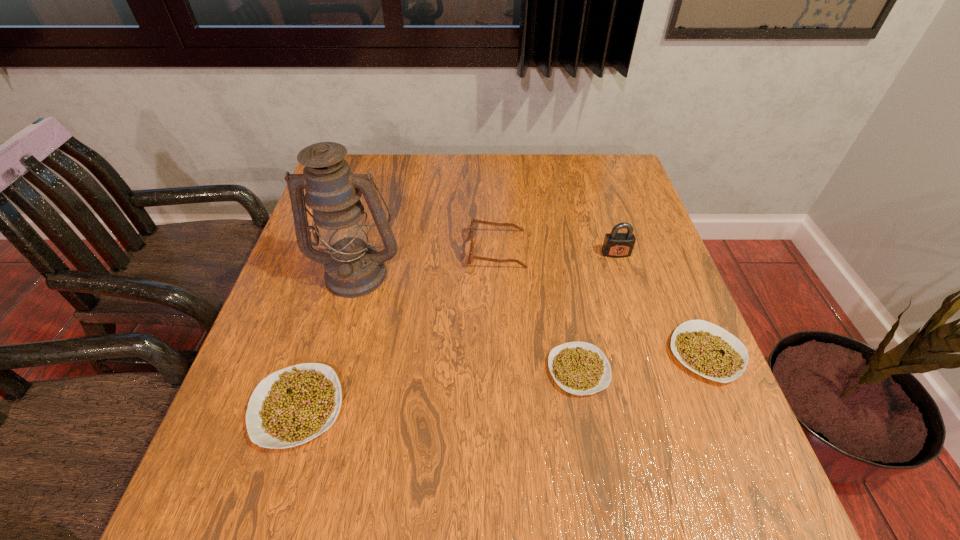
Where is `object that can be found as the fourth closest to the shortest legume`? The width and height of the screenshot is (960, 540). object that can be found as the fourth closest to the shortest legume is located at coordinates (353, 268).

Locate which legume ranks second in proximity to the third object from left to right. Please provide its 2D coordinates. Your answer should be formatted as a tuple, i.e. [(x, y)], where the tuple contains the x and y coordinates of a point satisfying the conditions above.

[(710, 351)]

Where is `legume that stands as the closest to the oil lamp`? Image resolution: width=960 pixels, height=540 pixels. legume that stands as the closest to the oil lamp is located at coordinates (292, 406).

Identify the location of free space that satisfies the following two spatial constraints: 1. on the front-facing side of the third object from left to right; 2. on the right side of the fifth tallest object. (501, 354).

Where is `free space that satisfies the following two spatial constraints: 1. on the front of the second shortest legume near the keyhole; 2. on the right side of the fifth shortest object`? The image size is (960, 540). free space that satisfies the following two spatial constraints: 1. on the front of the second shortest legume near the keyhole; 2. on the right side of the fifth shortest object is located at coordinates (647, 354).

Identify the location of vacant area that satisfies the following two spatial constraints: 1. on the front of the fifth object from left to right near the keyhole; 2. on the left side of the second shortest legume. (647, 354).

This screenshot has height=540, width=960. What are the coordinates of `vacant position in the image that satisfies the following two spatial constraints: 1. on the front of the rightmost object near the keyhole; 2. on the left side of the padlock` in the screenshot? It's located at (647, 354).